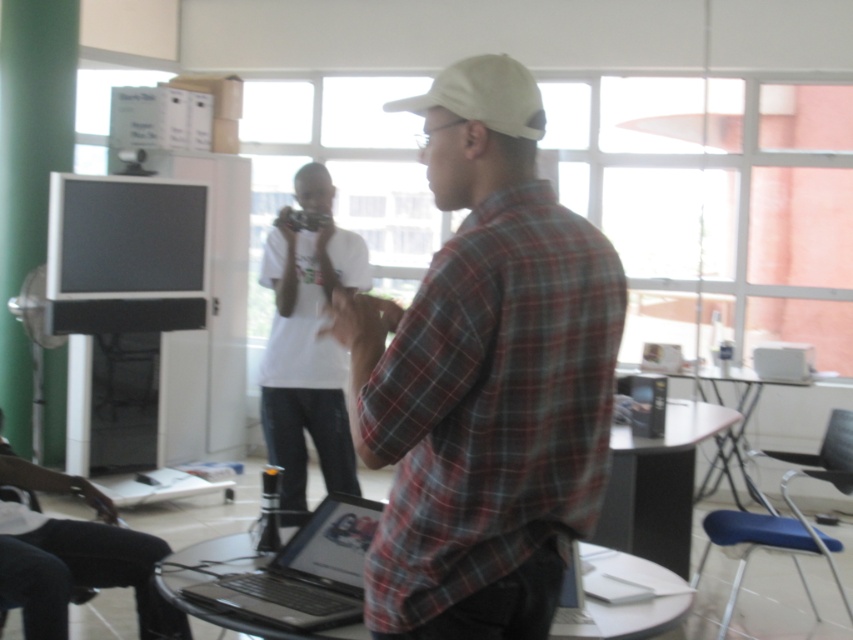
You are standing in the office and need to place a new monitor between the black glossy laptop at center and the white matte shirt at center. Based on their positions, which object should the monitor be placed above to ensure it is positioned correctly?

The monitor should be placed above the black glossy laptop at center because it is located below the white matte shirt at center.

You are standing at the point labeled as point (x=253, y=593) in the image. If you want to take a photo of the entire room, where should you position yourself relative to this point to ensure the camera can capture the whole scene?

To capture the entire room from point (x=253, y=593), you should position the camera 1.96 meters away from the point, as this distance ensures the camera can encompass the whole scene while maintaining proper framing.

You are organizing a workspace and need to place the black glossy laptop at center and the white matte shirt at center on a shelf. Which object should you place first if you want to arrange them from smallest to largest?

The black glossy laptop at center should be placed first since it is smaller than the white matte shirt at center.